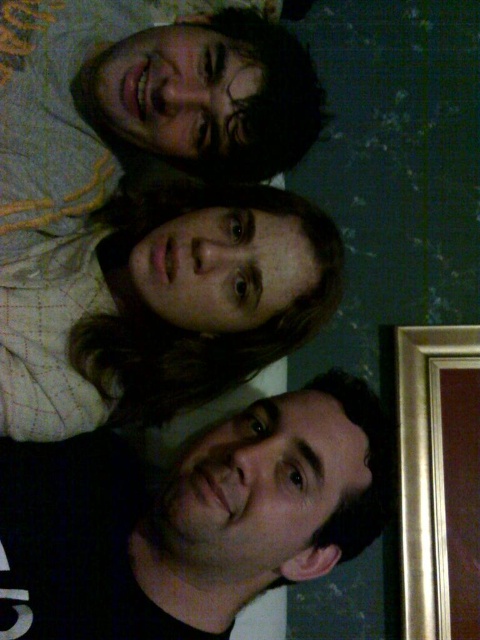
You are a photographer adjusting the lighting in a room. You need to ensure that the matte white shirt at center and the gold metallic picture frame at right are both well lit. Given their distance apart, will you need to adjust the lights to accommodate both objects?

The matte white shirt at center is 27.04 inches from the gold metallic picture frame at right, so the distance between them is relatively close. This means adjusting the lights to cover both objects should be manageable without needing significant adjustments beyond standard setup.

You are an interior designer assessing the layout of this room. You notice the black matte shirt at lower left and the gold metallic picture frame at right. Which object is closer to the floor?

The black matte shirt at lower left is shorter than the gold metallic picture frame at right, so the black matte shirt at lower left is closer to the floor.

You are trying to decide which shirt to wear for a casual event. You have a black matte shirt at lower left and a matte white shirt at center. Which shirt would you choose if you want a more modest look, considering their sizes?

The black matte shirt at lower left is larger in size than the matte white shirt at center, so choosing the black matte shirt at lower left would provide a more modest look due to its larger size.